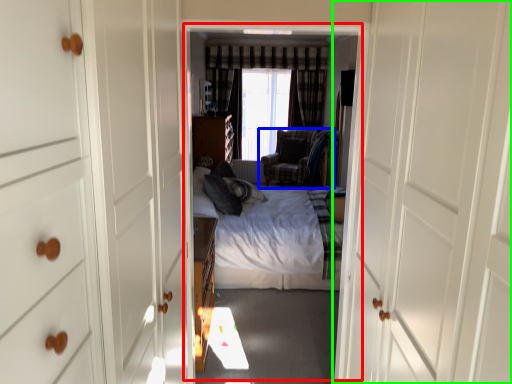
Question: Which object is positioned farthest from residence (highlighted by a red box)? Select from chair (highlighted by a blue box) and door (highlighted by a green box).

Choices:
 (A) chair
 (B) door

Answer: (B)